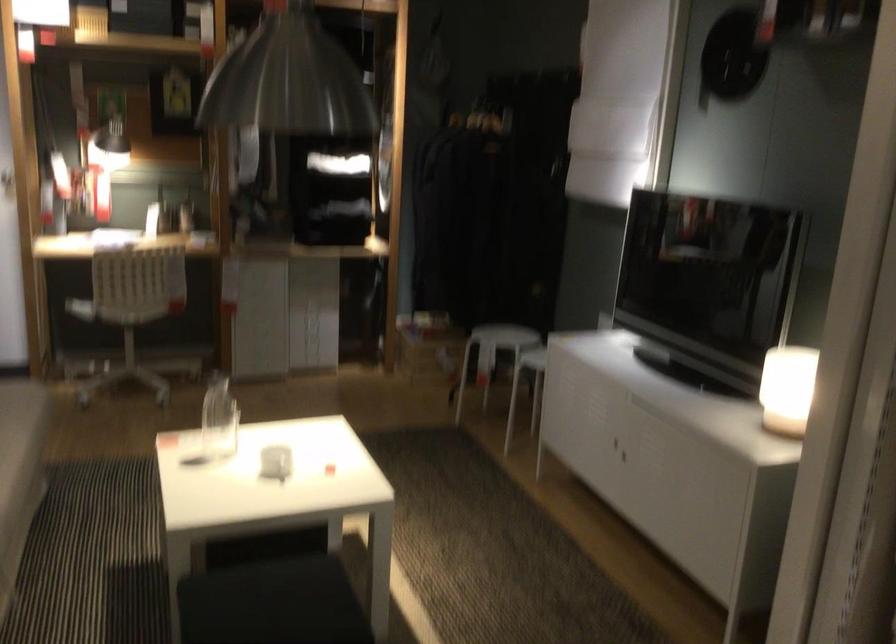
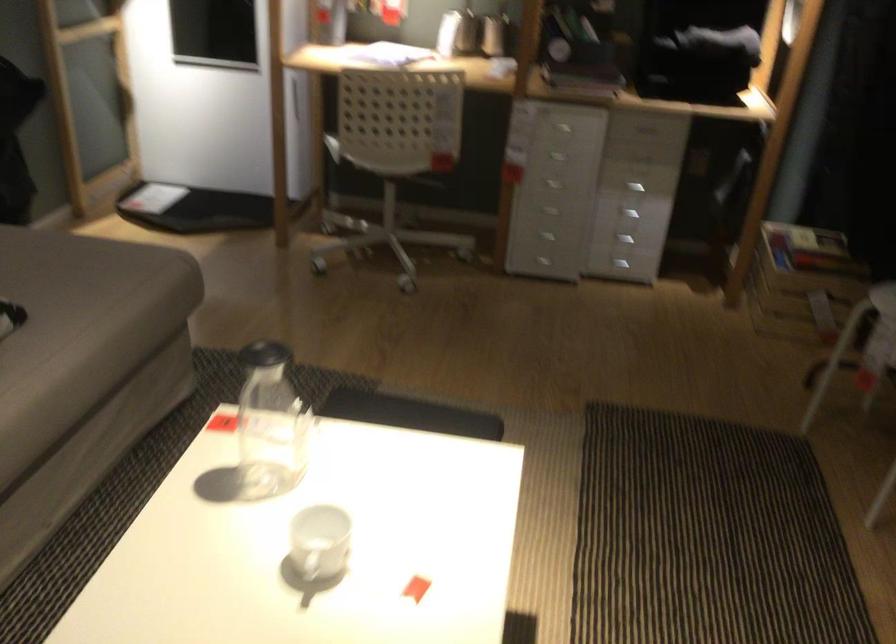
Locate, in the second image, the point that corresponds to point (256, 270) in the first image.

(563, 128)